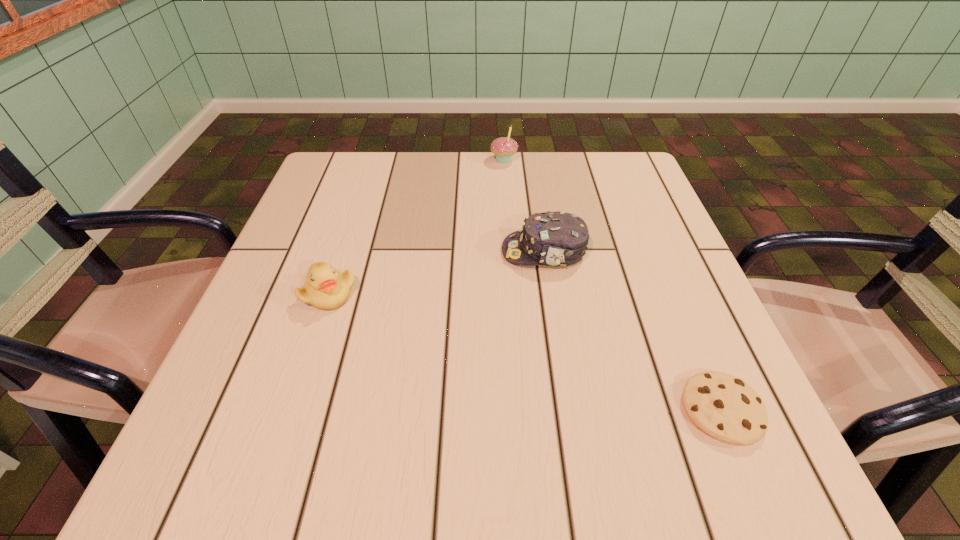
Where is `free space located 0.380m on the front-facing side of the headwear`? free space located 0.380m on the front-facing side of the headwear is located at coordinates (320, 252).

The image size is (960, 540). What are the coordinates of `vacant area situated on the beak of the leftmost object` in the screenshot? It's located at (309, 353).

This screenshot has height=540, width=960. In order to click on vacant position located 0.200m on the back of the rightmost object in this screenshot , I will do `click(670, 286)`.

Locate an element on the screen. This screenshot has width=960, height=540. object positioned at the far edge is located at coordinates (504, 148).

This screenshot has width=960, height=540. In order to click on object that is at the near edge in this screenshot , I will do 725,407.

I want to click on object that is at the left edge, so click(326, 288).

This screenshot has height=540, width=960. I want to click on object positioned at the right edge, so click(x=725, y=407).

You are a GUI agent. You are given a task and a screenshot of the screen. Output one action in this format:
    pyautogui.click(x=<x>, y=<y>)
    Task: Click on the object situated at the near right corner
    This screenshot has width=960, height=540.
    Given the screenshot: What is the action you would take?
    click(x=725, y=407)

Locate an element on the screen. blank space at the far edge of the desktop is located at coordinates (495, 182).

Identify the location of free space at the near edge. (503, 478).